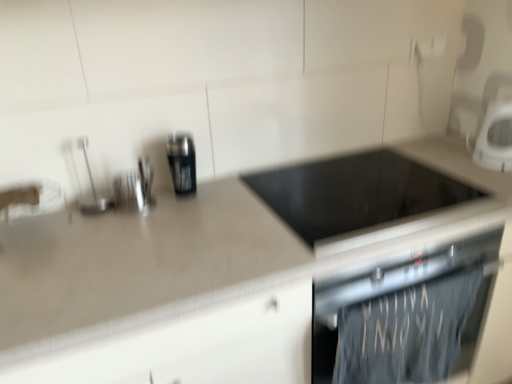
Find the location of a particular element. The image size is (512, 384). free space in front of brushed metal spoon at upper left, the 3th appliance in the right-to-left sequence is located at coordinates (89, 234).